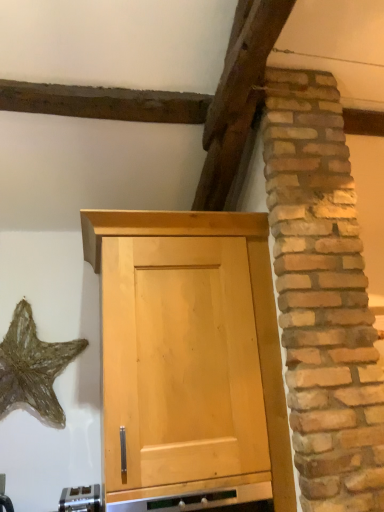
Question: Should I look upward or downward to see satin silver toaster at lower center?

Choices:
 (A) down
 (B) up

Answer: (A)

Question: Is gold metallic starfish at lower left looking in the opposite direction of light wood cabinet at center?

Choices:
 (A) no
 (B) yes

Answer: (A)

Question: Can you confirm if gold metallic starfish at lower left is taller than light wood cabinet at center?

Choices:
 (A) no
 (B) yes

Answer: (A)

Question: From the image's perspective, would you say gold metallic starfish at lower left is shown under light wood cabinet at center?

Choices:
 (A) yes
 (B) no

Answer: (B)

Question: Does gold metallic starfish at lower left have a smaller size compared to light wood cabinet at center?

Choices:
 (A) no
 (B) yes

Answer: (B)

Question: Would you consider gold metallic starfish at lower left to be distant from light wood cabinet at center?

Choices:
 (A) no
 (B) yes

Answer: (A)

Question: Is gold metallic starfish at lower left closer to camera compared to light wood cabinet at center?

Choices:
 (A) yes
 (B) no

Answer: (B)

Question: From the image's perspective, is light wood cabinet at center under satin silver toaster at lower center?

Choices:
 (A) yes
 (B) no

Answer: (B)

Question: Is light wood cabinet at center behind satin silver toaster at lower center?

Choices:
 (A) yes
 (B) no

Answer: (B)

Question: Is light wood cabinet at center far away from satin silver toaster at lower center?

Choices:
 (A) no
 (B) yes

Answer: (A)

Question: Is light wood cabinet at center closer to the viewer compared to satin silver toaster at lower center?

Choices:
 (A) no
 (B) yes

Answer: (B)

Question: Considering the relative sizes of light wood cabinet at center and satin silver toaster at lower center in the image provided, is light wood cabinet at center bigger than satin silver toaster at lower center?

Choices:
 (A) yes
 (B) no

Answer: (A)

Question: Does light wood cabinet at center appear on the left side of satin silver toaster at lower center?

Choices:
 (A) no
 (B) yes

Answer: (A)

Question: Is gold metallic starfish at lower left smaller than satin silver toaster at lower center?

Choices:
 (A) no
 (B) yes

Answer: (A)